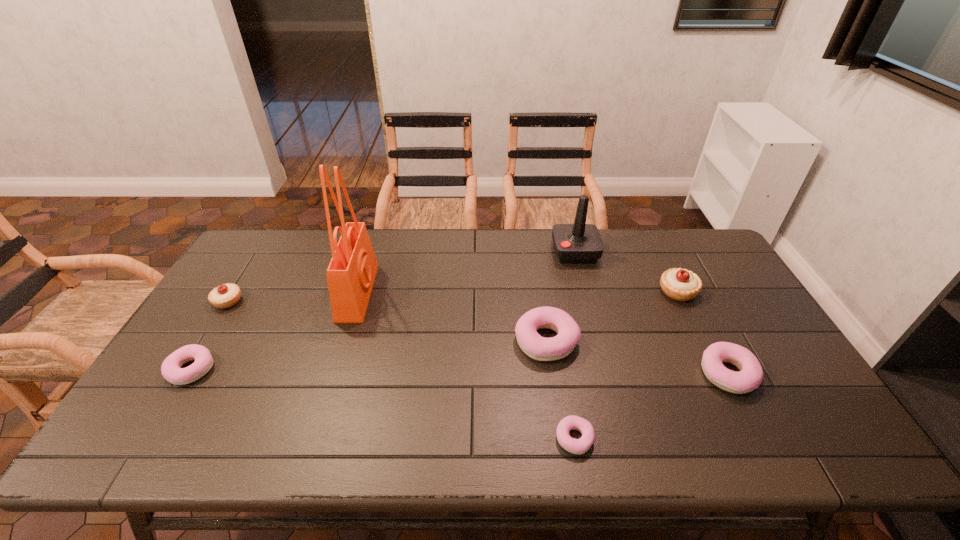
Locate an element on the screen. the sixth object from right to left is located at coordinates (351, 273).

Find the location of a particular element. tote bag is located at coordinates (351, 273).

The height and width of the screenshot is (540, 960). What are the coordinates of `the seventh shortest object` in the screenshot? It's located at 574,243.

Find the location of a particular element. This screenshot has width=960, height=540. the tallest pastry is located at coordinates (679, 284).

Locate an element on the screen. the right beige pastry is located at coordinates (679, 284).

The width and height of the screenshot is (960, 540). I want to click on the left beige pastry, so click(x=224, y=296).

You are a GUI agent. You are given a task and a screenshot of the screen. Output one action in this format:
    pyautogui.click(x=<x>, y=<y>)
    Task: Click on the biggest pink pastry
    This screenshot has height=540, width=960.
    Given the screenshot: What is the action you would take?
    pyautogui.click(x=537, y=347)

Where is `the rightmost pink pastry`? The width and height of the screenshot is (960, 540). the rightmost pink pastry is located at coordinates (750, 376).

You are a GUI agent. You are given a task and a screenshot of the screen. Output one action in this format:
    pyautogui.click(x=<x>, y=<y>)
    Task: Click on the third shortest object
    The height and width of the screenshot is (540, 960).
    Given the screenshot: What is the action you would take?
    pyautogui.click(x=750, y=376)

The height and width of the screenshot is (540, 960). In order to click on the leftmost pink pastry in this screenshot , I will do `click(171, 370)`.